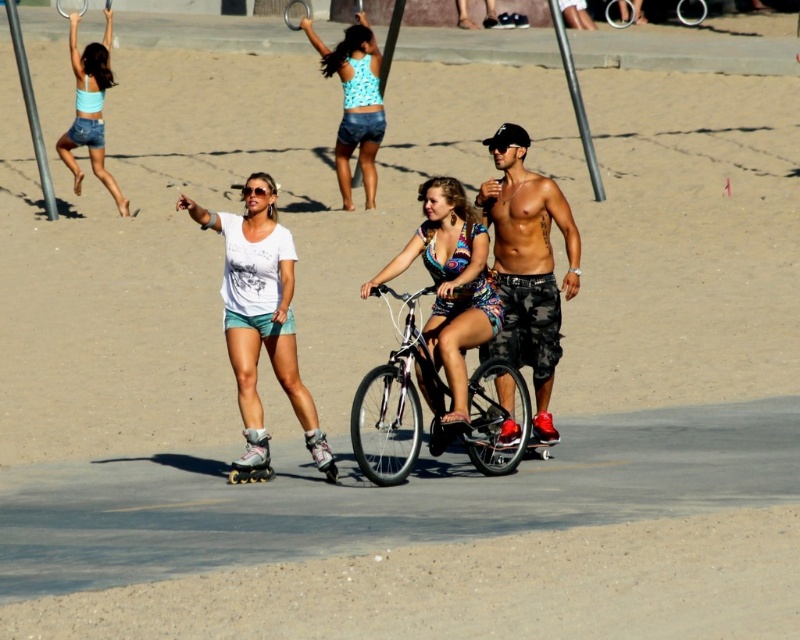
You are a photographer trying to capture the scene. The blue printed tank top at center and denim shorts at upper left are in your frame. Based on their sizes in the image, which one would appear larger?

The blue printed tank top at center appears larger because it has a greater height compared to the denim shorts at upper left.

You are a photographer trying to capture a candid shot of the denim shorts at upper left and the black rubber skateboard at center. Since you want to ensure both are in focus, you need to know their relative sizes. Which object is taller?

The denim shorts at upper left is taller than the black rubber skateboard at center according to the description.